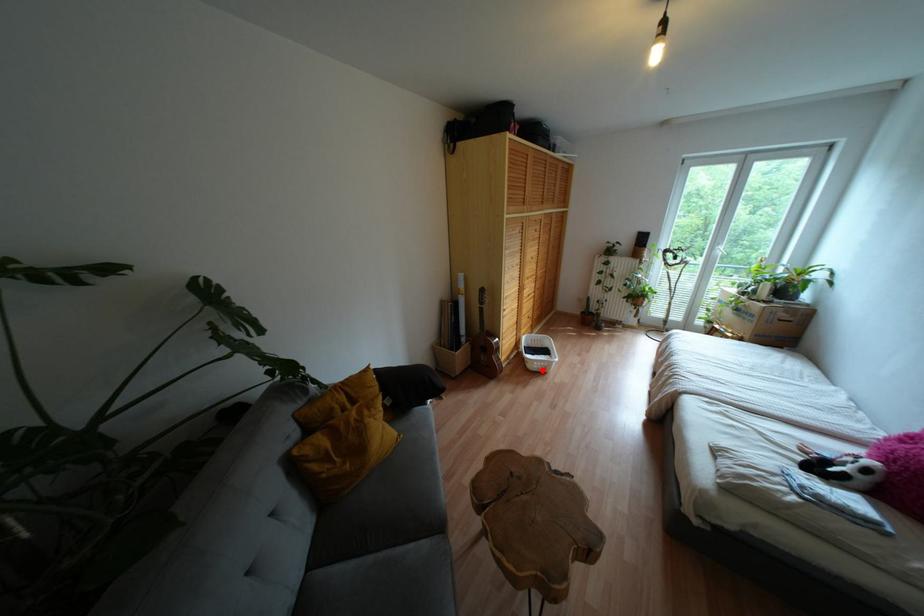
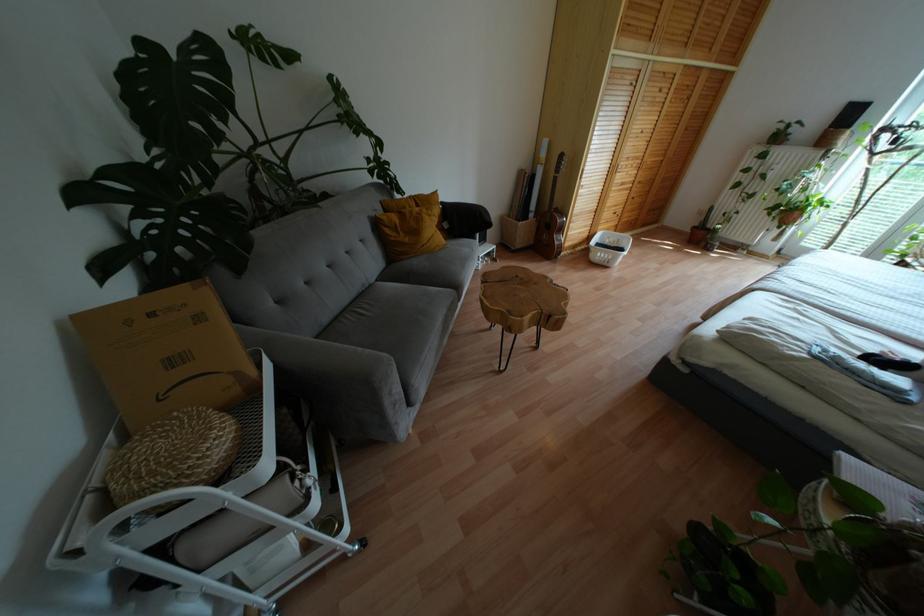
Question: I am providing you with two images of the same scene from different viewpoints. A red point is shown in image1. For the corresponding object point in image2, is it positioned nearer or farther from the camera?

Choices:
 (A) Nearer
 (B) Farther

Answer: (B)